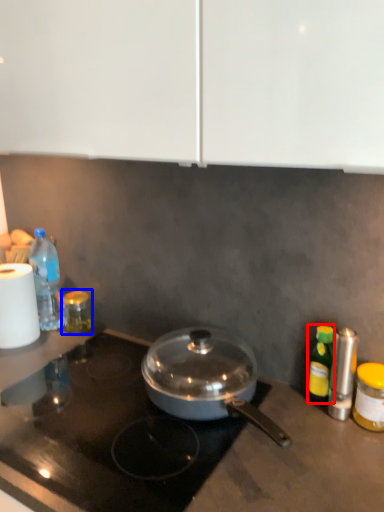
Question: Which of the following is the farthest to the observer, bottle (highlighted by a red box) or bottle (highlighted by a blue box)?

Choices:
 (A) bottle
 (B) bottle

Answer: (B)